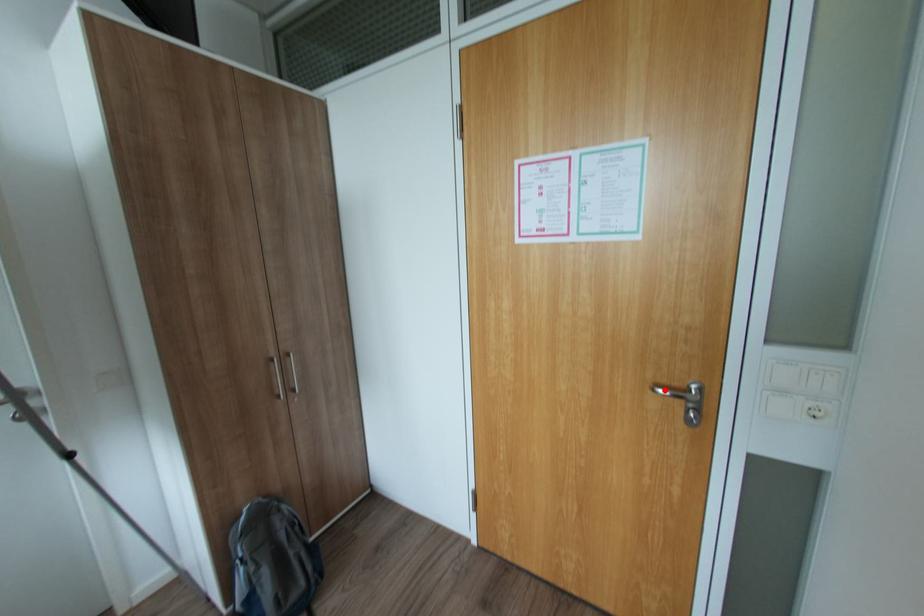
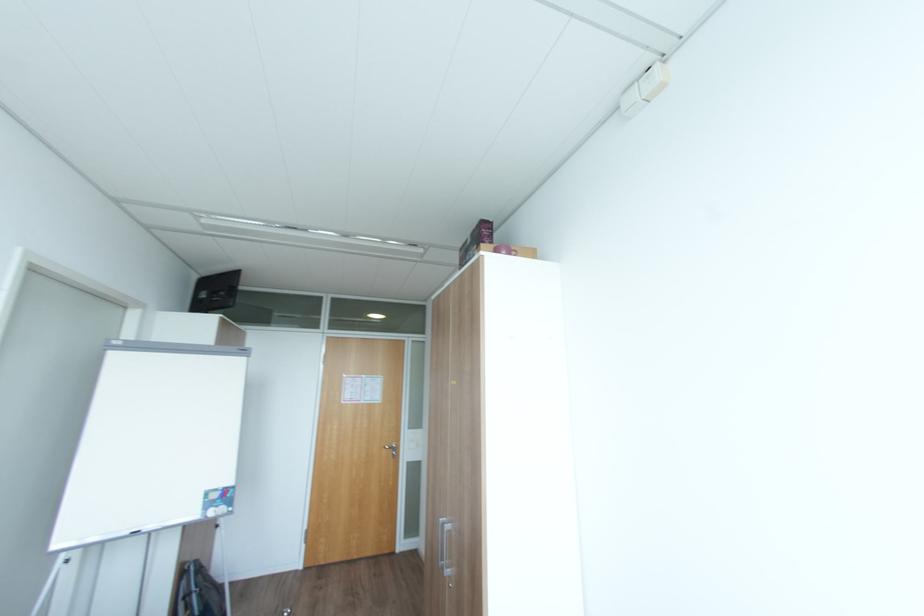
Question: I am providing you with two images of the same scene from different viewpoints. In image1, a red point is highlighted. Considering the same 3D point in image2, which of the following is correct?

Choices:
 (A) It is closer
 (B) It is farther

Answer: (B)